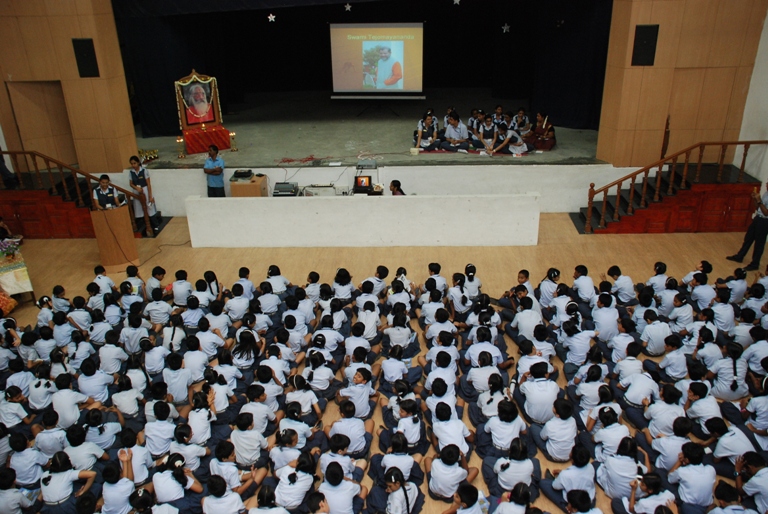
Locate an element on the screen. The image size is (768, 514). floor is located at coordinates (670, 244), (346, 252), (60, 252).